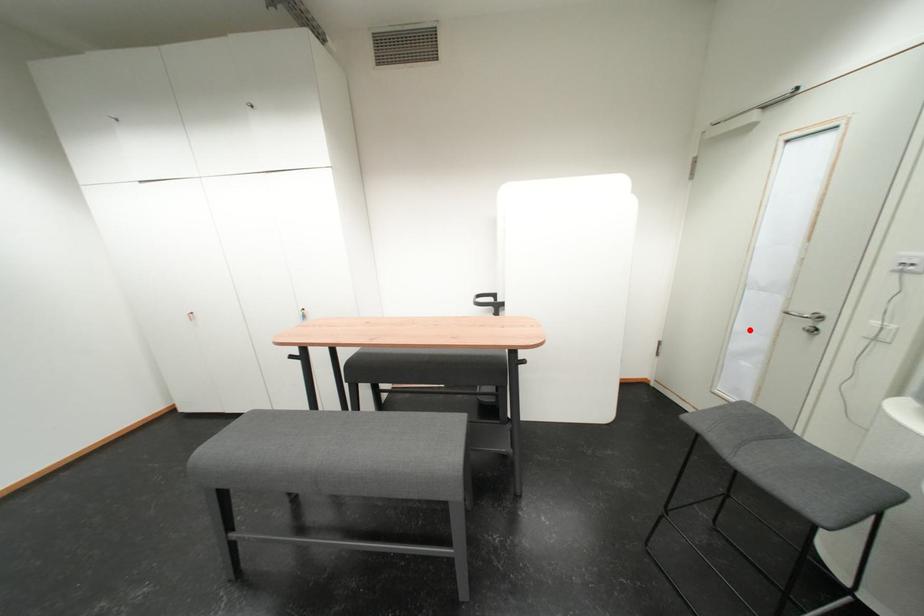
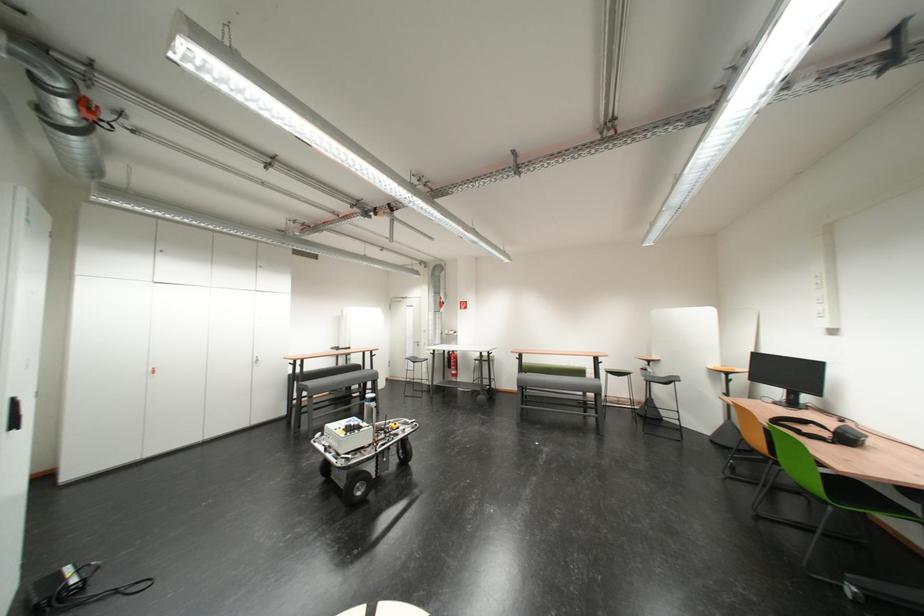
Question: I am providing you with two images of the same scene from different viewpoints. A red point is shown in image1. For the corresponding object point in image2, is it positioned nearer or farther from the camera?

Choices:
 (A) Nearer
 (B) Farther

Answer: (B)